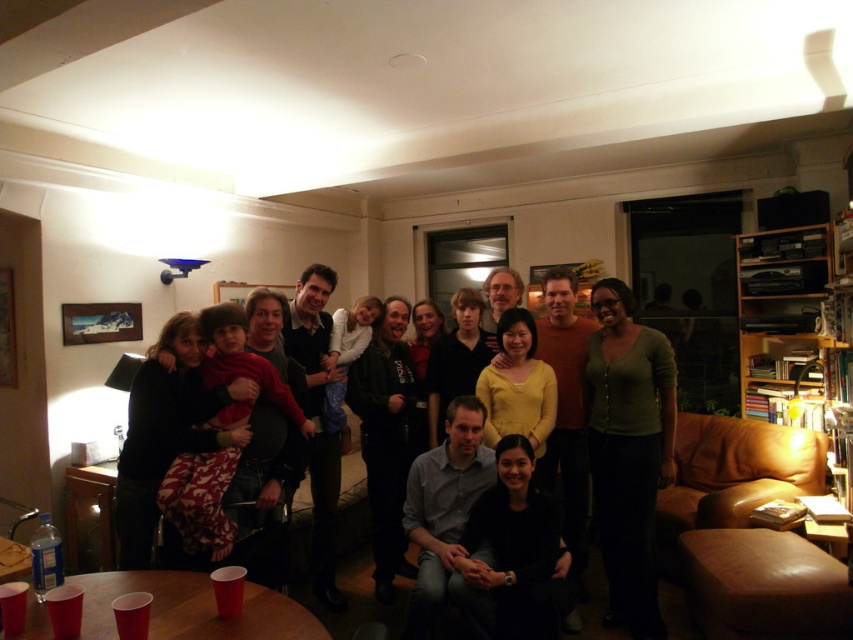
Is matte black sweater at center below yellow matte sweater at center?

Correct, matte black sweater at center is located below yellow matte sweater at center.

Can you confirm if matte black sweater at center is bigger than yellow matte sweater at center?

Yes, matte black sweater at center is bigger than yellow matte sweater at center.

Is point (194, 396) positioned before point (500, 328)?

Yes, it is.

Locate an element on the screen. matte black sweater at center is located at coordinates (163, 433).

This screenshot has height=640, width=853. What do you see at coordinates (610, 467) in the screenshot? I see `matte black jacket at center` at bounding box center [610, 467].

Can you confirm if matte black jacket at center is bigger than wooden bookshelf at upper right?

Yes, matte black jacket at center is bigger than wooden bookshelf at upper right.

Does point (628, 611) lie in front of point (758, 264)?

That is True.

This screenshot has width=853, height=640. Identify the location of matte black jacket at center. (610, 467).

Which is above, matte black jacket at center or dark brown hair at center?

Positioned higher is matte black jacket at center.

Is matte black jacket at center bigger than dark brown hair at center?

Yes.

This screenshot has width=853, height=640. What do you see at coordinates (610, 467) in the screenshot?
I see `matte black jacket at center` at bounding box center [610, 467].

Locate an element on the screen. The image size is (853, 640). matte black jacket at center is located at coordinates (610, 467).